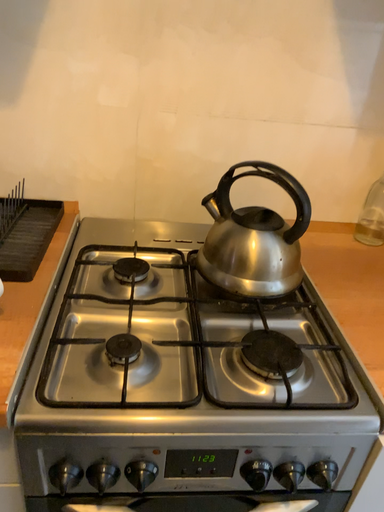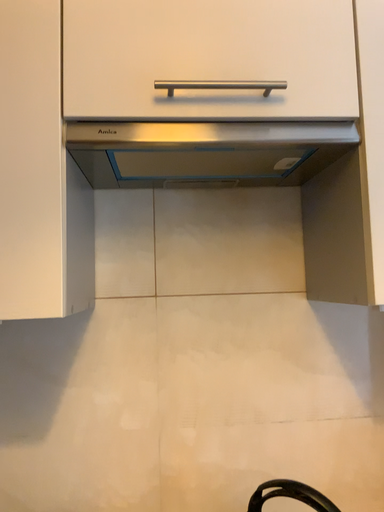
Question: How did the camera likely rotate when shooting the video?

Choices:
 (A) rotated downward
 (B) rotated upward

Answer: (B)